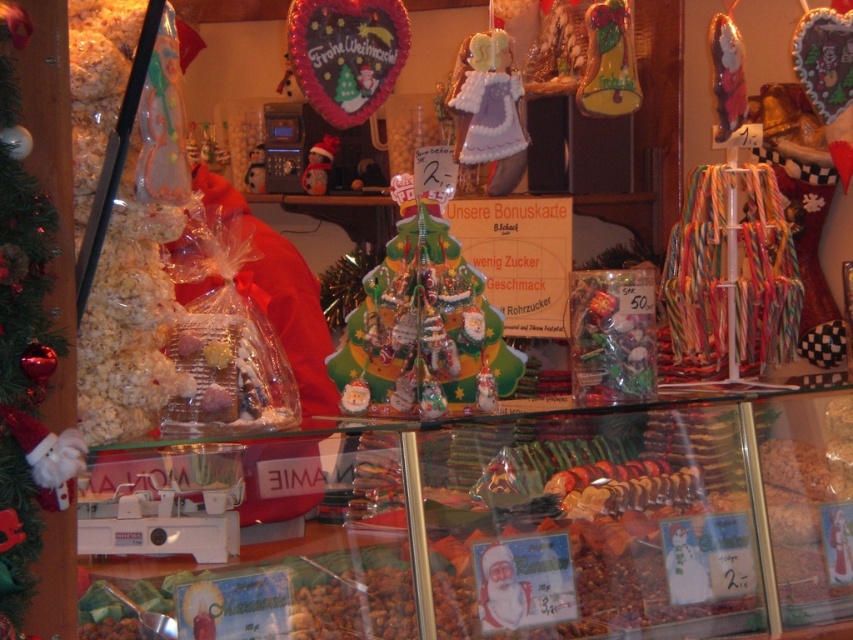
You are a customer in the shop and want to choose between the shiny red bauble at left and the shiny green candy at center. Which one has a smaller diameter?

The shiny red bauble at left is thinner than the shiny green candy at center, so the shiny red bauble at left has a smaller diameter.

You are a customer in the store looking at the display. You want to pick up the shiny red bauble at left and the shiny green candy at center. Which item is positioned lower in the display?

The shiny red bauble at left is located below the shiny green candy at center, so it is positioned lower in the display.